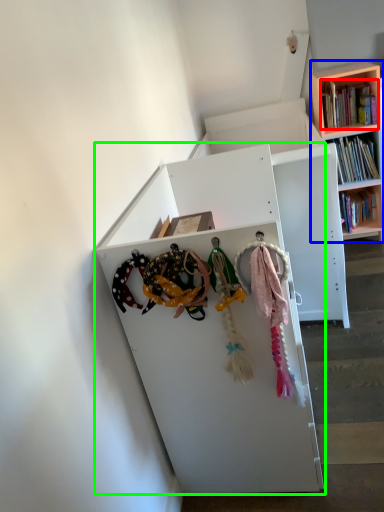
Question: Which object is positioned farthest from book (highlighted by a red box)? Select from bookcase (highlighted by a blue box) and shelf (highlighted by a green box).

Choices:
 (A) bookcase
 (B) shelf

Answer: (B)